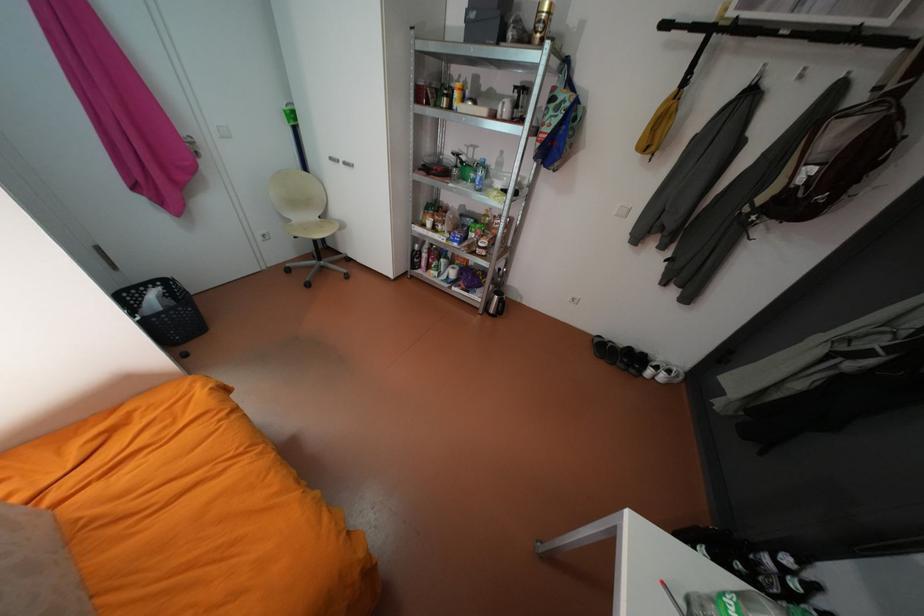
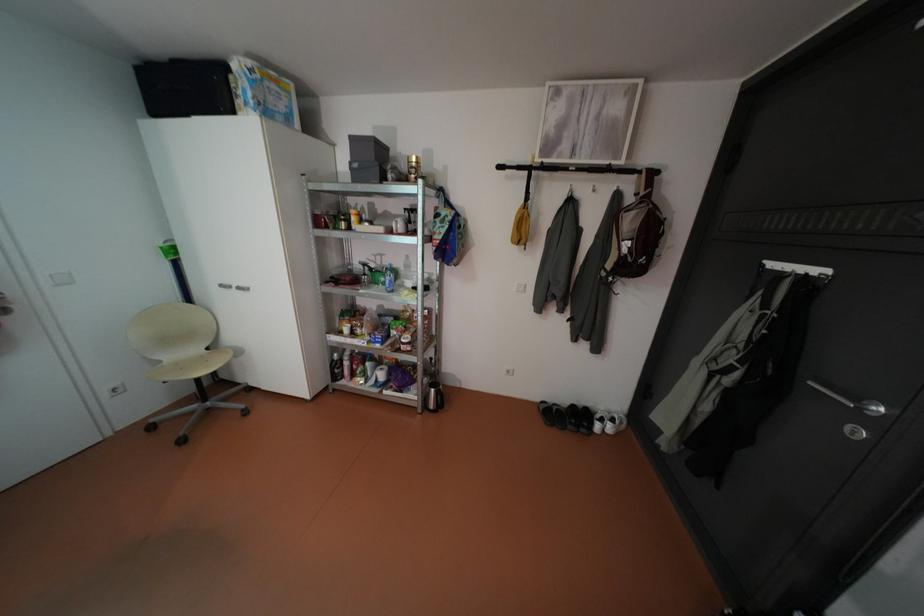
Locate, in the second image, the point that corresponds to point (341, 158) in the first image.

(232, 285)